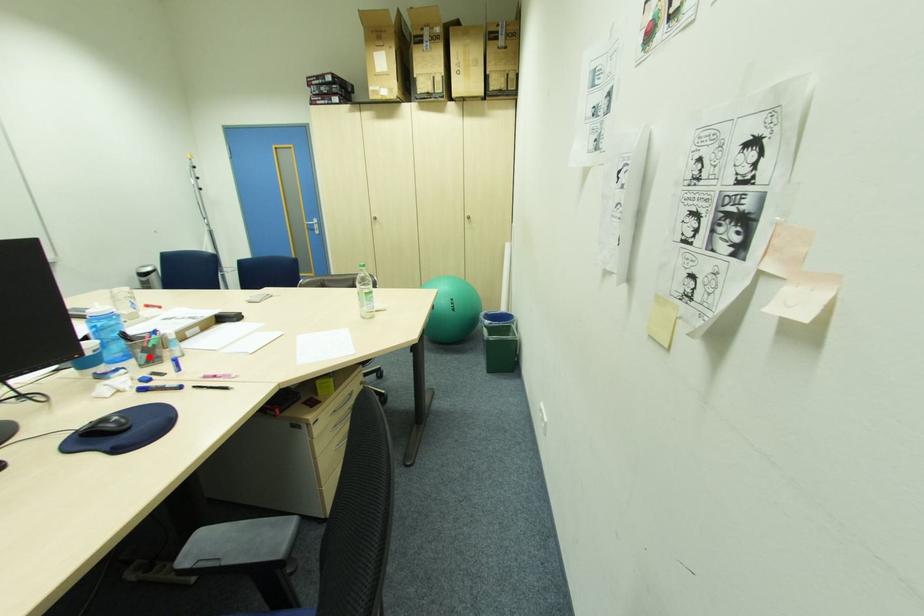
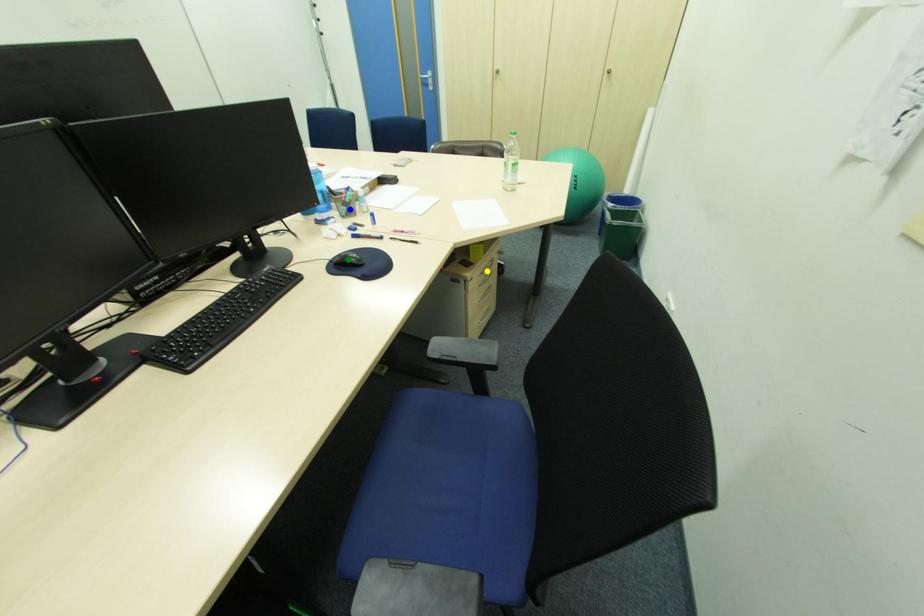
Question: I am providing you with two images of the same scene from different viewpoints. A red point is marked on the first image. You are given multiple points on the second image. Which point in image 2 is actually the same real-world point as the red point in image 1?

Choices:
 (A) green point
 (B) blue point
 (C) yellow point

Answer: (B)